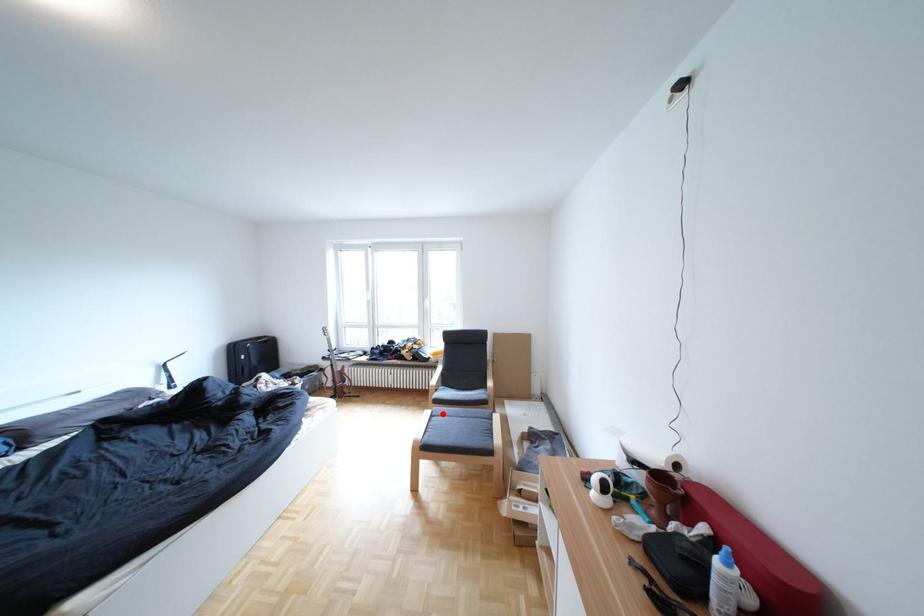
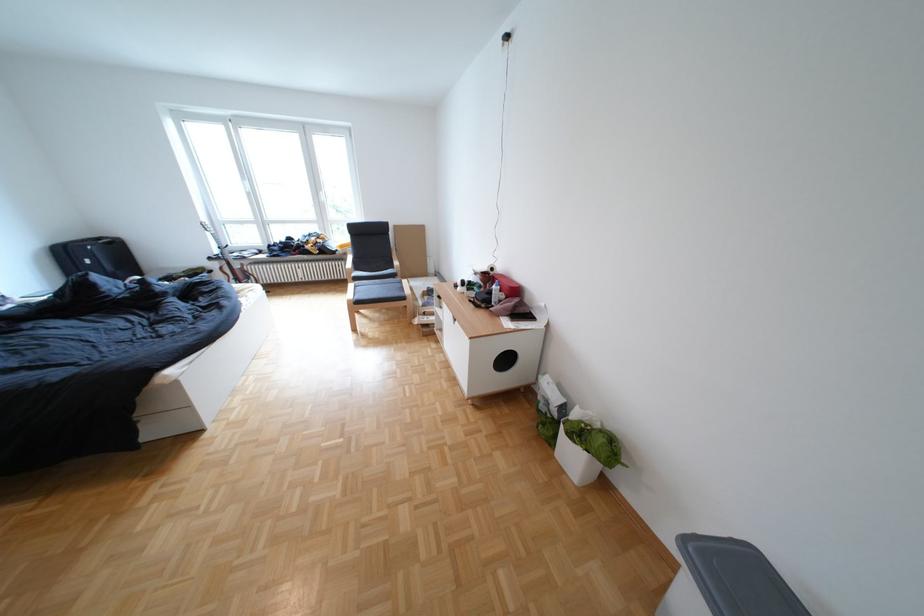
Find the pixel in the second image that matches the highlighted location in the first image.

(367, 286)